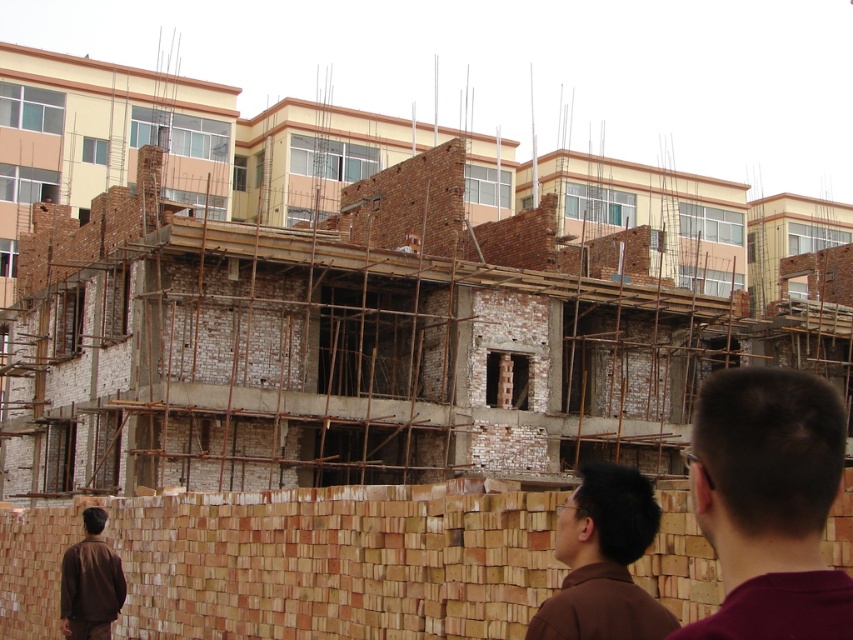
You are standing at the origin point of the construction site image. The origin is at the bottom left corner of the image. You want to place a safety sign exactly at the location of the brown brick wall at lower center. What are the coordinates where you should place the safety sign?

The coordinates for the brown brick wall at lower center are at point (299, 563).

In the scene shown: You are a construction worker standing at the entrance of the construction site. You need to move a heavy equipment from the lower center to the upper right corner of the site. Which path would be safer to avoid the brown brick wall at lower center and the brown hair at upper right?

The brown brick wall at lower center might be wider than brown hair at upper right, so it is safer to move the equipment around the narrower brown hair at upper right to avoid collision.

You are an architect examining the construction site. You notice two items in the scene labeled as brown hair at upper right and brown matte shirt at lower left. Which of these two items appears bigger in the image?

The brown hair at upper right is larger in size than the brown matte shirt at lower left, so the brown hair at upper right appears bigger in the image.